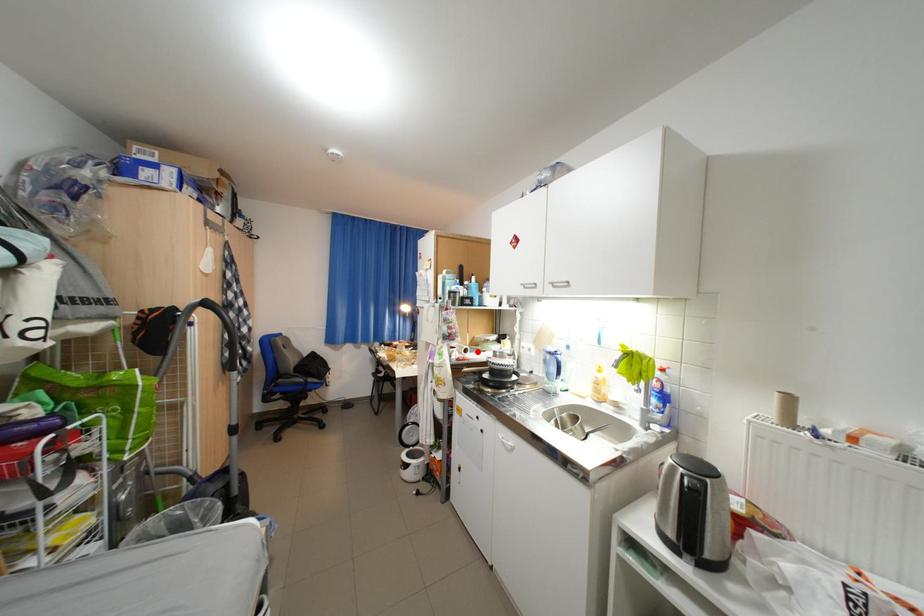
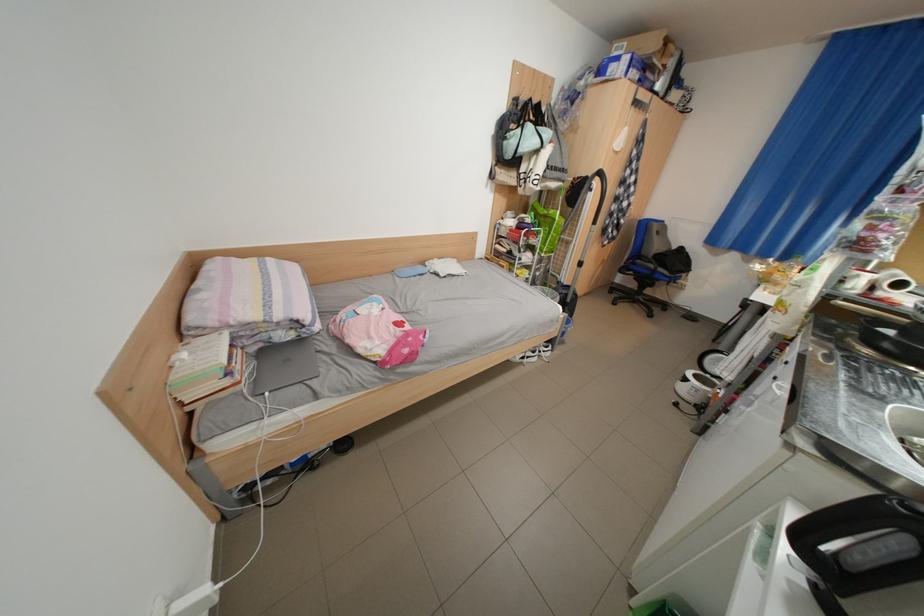
Find the pixel in the second image that matches the highlighted location in the first image.

(912, 286)